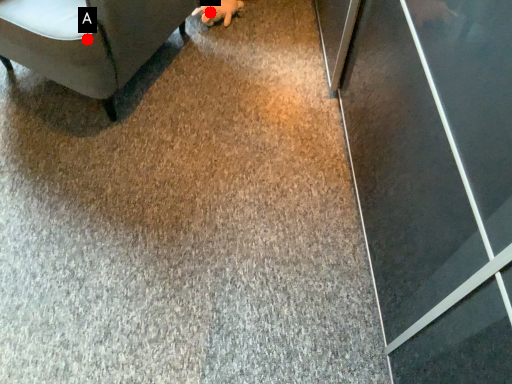
Question: Two points are circled on the image, labeled by A and B beside each circle. Among these points, which one is nearest to the camera?

Choices:
 (A) A is closer
 (B) B is closer

Answer: (A)